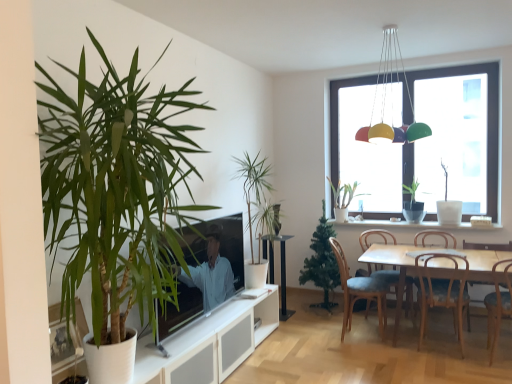
What do you see at coordinates (436, 236) in the screenshot? The width and height of the screenshot is (512, 384). I see `wooden chair at lower right` at bounding box center [436, 236].

Image resolution: width=512 pixels, height=384 pixels. Find the location of `green leafy plant at center, positioned as the fifth houseplant in right-to-left order`. green leafy plant at center, positioned as the fifth houseplant in right-to-left order is located at coordinates (257, 207).

Identify the location of green matte christmas tree at center, acting as the third houseplant starting from the front. The image size is (512, 384). (322, 263).

What do you see at coordinates (343, 198) in the screenshot? I see `green matte plant at window, acting as the 6th houseplant starting from the front` at bounding box center [343, 198].

What are the coordinates of `multicolored plastic light fixture at upper center` in the screenshot? It's located at (385, 99).

In the image, is matte black tv at center positioned in front of or behind wooden chair at lower right, which is counted as the 5th chair, starting from the left?

matte black tv at center is positioned closer to the viewer than wooden chair at lower right, which is counted as the 5th chair, starting from the left.

Considering the positions of points (203, 222) and (480, 282), is point (203, 222) farther from camera compared to point (480, 282)?

No, (203, 222) is closer to viewer.

Looking at this image, from the image's perspective, who appears lower, matte black tv at center or wooden chair at lower right, the 1th chair viewed from the right?

From the image's view, wooden chair at lower right, the 1th chair viewed from the right, is below.

Considering the relative sizes of black glass table at center and green leafy plant at center, positioned as the fifth houseplant in right-to-left order, in the image provided, is black glass table at center wider than green leafy plant at center, positioned as the fifth houseplant in right-to-left order,?

Incorrect, the width of black glass table at center does not surpass that of green leafy plant at center, positioned as the fifth houseplant in right-to-left order.

From the image's perspective, would you say black glass table at center is positioned over green leafy plant at center, the second houseplant positioned from the front?

No.

Is black glass table at center positioned beyond the bounds of green leafy plant at center, positioned as the fifth houseplant in right-to-left order?

black glass table at center is positioned outside green leafy plant at center, positioned as the fifth houseplant in right-to-left order.

Where is `table below the green leafy plant at center, which is the fifth houseplant in back-to-front order (from the image's perspective)`? The height and width of the screenshot is (384, 512). table below the green leafy plant at center, which is the fifth houseplant in back-to-front order (from the image's perspective) is located at coordinates (281, 269).

How many degrees apart are the facing directions of white ceramic window sill at center and green leafy plant at left, the 6th houseplant in the right-to-left sequence?

The angle between the facing direction of white ceramic window sill at center and the facing direction of green leafy plant at left, the 6th houseplant in the right-to-left sequence, is 91.6 degrees.

Between white ceramic window sill at center and green leafy plant at left, the 1th houseplant viewed from the front, which one has larger size?

green leafy plant at left, the 1th houseplant viewed from the front.

Which object is wider, white ceramic window sill at center or green leafy plant at left, the 6th houseplant in the right-to-left sequence?

green leafy plant at left, the 6th houseplant in the right-to-left sequence, is wider.

Is green leafy plant at left, the 6th houseplant in the right-to-left sequence, surrounded by white ceramic window sill at center?

Actually, green leafy plant at left, the 6th houseplant in the right-to-left sequence, is outside white ceramic window sill at center.

From a real-world perspective, is black glass table at center on green matte christmas tree at center, acting as the third houseplant starting from the front?

No.

Is there a large distance between black glass table at center and green matte christmas tree at center, which ranks as the third houseplant in left-to-right order?

That's not correct — black glass table at center is a little close to green matte christmas tree at center, which ranks as the third houseplant in left-to-right order.

In the scene shown: In the image, is black glass table at center positioned in front of or behind green matte christmas tree at center, which ranks as the third houseplant in left-to-right order?

black glass table at center is positioned farther from the viewer than green matte christmas tree at center, which ranks as the third houseplant in left-to-right order.

Can you confirm if black glass table at center is bigger than green matte christmas tree at center, which appears as the 4th houseplant when viewed from the back?

Incorrect, black glass table at center is not larger than green matte christmas tree at center, which appears as the 4th houseplant when viewed from the back.

Is wooden chair at lower right, the 1th chair viewed from the right, at the back of white glossy table at lower right?

Correct, white glossy table at lower right is looking away from wooden chair at lower right, the 1th chair viewed from the right.

Considering their positions, is white glossy table at lower right located in front of or behind wooden chair at lower right, the 1th chair viewed from the right?

Clearly, white glossy table at lower right is in front of wooden chair at lower right, the 1th chair viewed from the right.

Considering the relative positions of white glossy table at lower right and wooden chair at lower right, which is counted as the 5th chair, starting from the left, in the image provided, is white glossy table at lower right to the right of wooden chair at lower right, which is counted as the 5th chair, starting from the left, from the viewer's perspective?

Incorrect, white glossy table at lower right is not on the right side of wooden chair at lower right, which is counted as the 5th chair, starting from the left.

Is white glossy table at lower right taller than wooden chair at lower right, which is counted as the 5th chair, starting from the left?

In fact, white glossy table at lower right may be shorter than wooden chair at lower right, which is counted as the 5th chair, starting from the left.

Is black glass table at center taller than multicolored plastic light fixture at upper center?

In fact, black glass table at center may be shorter than multicolored plastic light fixture at upper center.

Can multicolored plastic light fixture at upper center be found inside black glass table at center?

Actually, multicolored plastic light fixture at upper center is outside black glass table at center.

Can you confirm if black glass table at center is thinner than multicolored plastic light fixture at upper center?

Yes, black glass table at center is thinner than multicolored plastic light fixture at upper center.

From a real-world perspective, is black glass table at center positioned over multicolored plastic light fixture at upper center based on gravity?

No, from a real-world perspective, black glass table at center is not over multicolored plastic light fixture at upper center

Is there a large distance between wooden chair at lower right, the 1th chair viewed from the right, and multicolored plastic light fixture at upper center?

Absolutely, wooden chair at lower right, the 1th chair viewed from the right, is distant from multicolored plastic light fixture at upper center.

Between wooden chair at lower right, which is counted as the 5th chair, starting from the left, and multicolored plastic light fixture at upper center, which one has smaller size?

Smaller between the two is wooden chair at lower right, which is counted as the 5th chair, starting from the left.

From the image's perspective, is wooden chair at lower right, which is counted as the 5th chair, starting from the left, under multicolored plastic light fixture at upper center?

Yes.

Is point (486, 244) closer to camera compared to point (384, 41)?

No.

Locate an element on the screen. This screenshot has height=384, width=512. the 5th chair counting from the right side of the matte black tv at center is located at coordinates (488, 246).

The height and width of the screenshot is (384, 512). There is a black glass table at center. In order to click on the 2nd houseplant above it (from a real-world perspective) in this screenshot , I will do `click(257, 207)`.

In the scene shown: Which object lies further to the anchor point wooden chair at right, the second chair when ordered from left to right, wooden chair at lower right, positioned as the 3th chair in right-to-left order, or green matte christmas tree at center, the 4th houseplant when ordered from right to left?

green matte christmas tree at center, the 4th houseplant when ordered from right to left, lies further to wooden chair at right, the second chair when ordered from left to right, than the other object.

Which object lies further to the anchor point transparent glass window at upper right, green matte plant at window, which is the 4th houseplant from left to right, or white glossy table at lower right?

white glossy table at lower right.

Estimate the real-world distances between objects in this image. Which object is further from wooden photo frame at lower left, green matte plant at window, acting as the 6th houseplant starting from the front, or multicolored plastic light fixture at upper center?

The object further to wooden photo frame at lower left is green matte plant at window, acting as the 6th houseplant starting from the front.

Estimate the real-world distances between objects in this image. Which object is further from wooden chair at right, the second chair when ordered from left to right, wooden chair at lower right, the 1th chair viewed from the right, or white glossy table at lower right?

Based on the image, wooden chair at lower right, the 1th chair viewed from the right, appears to be further to wooden chair at right, the second chair when ordered from left to right.

When comparing their distances from matte black tv at center, does green matte christmas tree at center, which appears as the 4th houseplant when viewed from the back, or white matte vase at right, which appears as the 4th houseplant when viewed from the front, seem closer?

Based on the image, green matte christmas tree at center, which appears as the 4th houseplant when viewed from the back, appears to be nearer to matte black tv at center.

Estimate the real-world distances between objects in this image. Which object is further from green matte christmas tree at center, acting as the third houseplant starting from the front, matte black tv at center or wooden chair at lower right?

The object further to green matte christmas tree at center, acting as the third houseplant starting from the front, is matte black tv at center.

Which object lies nearer to the anchor point green matte plant at window, the 2th houseplant in the back-to-front sequence, green matte christmas tree at center, acting as the third houseplant starting from the front, or multicolored plastic light fixture at upper center?

green matte christmas tree at center, acting as the third houseplant starting from the front.

Which object lies further to the anchor point wooden photo frame at lower left, green matte christmas tree at center, which appears as the 4th houseplant when viewed from the back, or wooden chair at lower right?

wooden chair at lower right lies further to wooden photo frame at lower left than the other object.

Locate an element on the screen. light fixture between brown wooden chair at lower right, which is counted as the second chair, starting from the right, and green matte plant at window, which is the 4th houseplant from left to right, along the z-axis is located at coordinates (385, 99).

Identify the location of window sill between white glossy table at lower right and green matte plant at window, the 2th houseplant in the back-to-front sequence, in the front-back direction. The width and height of the screenshot is (512, 384). (411, 225).

At what (x,y) coordinates should I click in order to perform the action: click on window sill situated between matte black tv at center and transparent glass window at upper right from left to right. Please return your answer as a coordinate pair (x, y). This screenshot has height=384, width=512. Looking at the image, I should click on (411, 225).

Locate an element on the screen. This screenshot has width=512, height=384. table situated between wooden photo frame at lower left and brown wooden chair at lower right, placed as the 4th chair when sorted from left to right, from left to right is located at coordinates (281, 269).